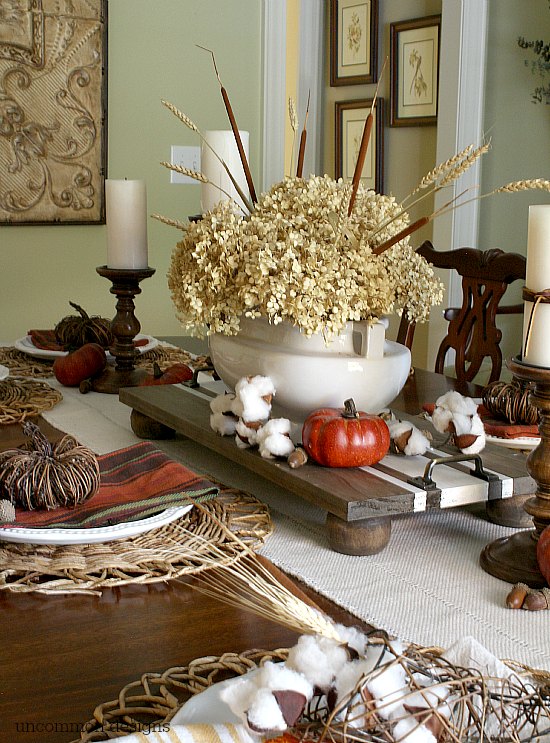
This screenshot has height=743, width=550. I want to click on wooden candlestick holder, so click(538, 473).